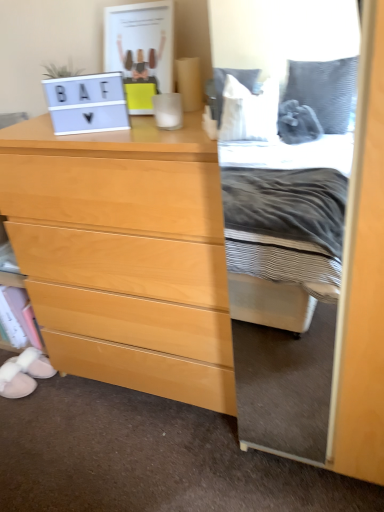
Question: Considering the relative sizes of white fluffy slippers at lower left, acting as the 2th shoe starting from the front, and light wood chest of drawers at left in the image provided, is white fluffy slippers at lower left, acting as the 2th shoe starting from the front, thinner than light wood chest of drawers at left?

Choices:
 (A) no
 (B) yes

Answer: (B)

Question: Is white fluffy slippers at lower left, acting as the 2th shoe starting from the front, taller than light wood chest of drawers at left?

Choices:
 (A) no
 (B) yes

Answer: (A)

Question: Is white fluffy slippers at lower left, acting as the 2th shoe starting from the front, behind light wood chest of drawers at left?

Choices:
 (A) yes
 (B) no

Answer: (A)

Question: Can you confirm if white fluffy slippers at lower left, positioned as the first shoe in back-to-front order, is wider than light wood chest of drawers at left?

Choices:
 (A) no
 (B) yes

Answer: (A)

Question: Is white fluffy slippers at lower left, acting as the 2th shoe starting from the front, outside light wood chest of drawers at left?

Choices:
 (A) yes
 (B) no

Answer: (A)

Question: Relative to white suede slipper at lower left, which is the second shoe from back to front, is matte white laptop at upper left in front or behind?

Choices:
 (A) front
 (B) behind

Answer: (A)

Question: Looking at their shapes, would you say matte white laptop at upper left is wider or thinner than white suede slipper at lower left, acting as the first shoe starting from the front?

Choices:
 (A) wide
 (B) thin

Answer: (B)

Question: Considering the relative positions of matte white laptop at upper left and white suede slipper at lower left, which is the second shoe from back to front, in the image provided, is matte white laptop at upper left to the left or to the right of white suede slipper at lower left, which is the second shoe from back to front,?

Choices:
 (A) right
 (B) left

Answer: (A)

Question: Choose the correct answer: Is matte white laptop at upper left inside white suede slipper at lower left, acting as the first shoe starting from the front, or outside it?

Choices:
 (A) outside
 (B) inside

Answer: (A)

Question: Is white suede slipper at lower left, which is the second shoe from back to front, in front of or behind white fluffy slippers at lower left, acting as the 2th shoe starting from the front, in the image?

Choices:
 (A) behind
 (B) front

Answer: (B)

Question: Do you think white suede slipper at lower left, which is the second shoe from back to front, is within white fluffy slippers at lower left, positioned as the first shoe in back-to-front order, or outside of it?

Choices:
 (A) inside
 (B) outside

Answer: (B)

Question: Considering the positions of white suede slipper at lower left, acting as the first shoe starting from the front, and white fluffy slippers at lower left, positioned as the first shoe in back-to-front order, in the image, is white suede slipper at lower left, acting as the first shoe starting from the front, taller or shorter than white fluffy slippers at lower left, positioned as the first shoe in back-to-front order,?

Choices:
 (A) short
 (B) tall

Answer: (A)

Question: Is white suede slipper at lower left, acting as the first shoe starting from the front, to the left or to the right of white fluffy slippers at lower left, positioned as the first shoe in back-to-front order, in the image?

Choices:
 (A) left
 (B) right

Answer: (A)

Question: In terms of width, does light wood chest of drawers at left look wider or thinner when compared to matte white laptop at upper left?

Choices:
 (A) wide
 (B) thin

Answer: (A)

Question: Would you say light wood chest of drawers at left is to the left or to the right of matte white laptop at upper left in the picture?

Choices:
 (A) left
 (B) right

Answer: (B)